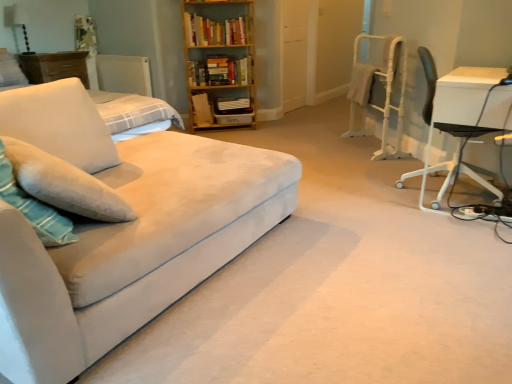
Question: Can you confirm if white fabric lampshade at upper left is smaller than white soft pillow at left, acting as the second pillow starting from the left?

Choices:
 (A) yes
 (B) no

Answer: (A)

Question: Are white fabric lampshade at upper left and white soft pillow at left, which ranks as the 1th pillow in bottom-to-top order, beside each other?

Choices:
 (A) no
 (B) yes

Answer: (A)

Question: Is white fabric lampshade at upper left not inside white soft pillow at left, which is counted as the first pillow, starting from the front?

Choices:
 (A) no
 (B) yes

Answer: (B)

Question: Does white fabric lampshade at upper left have a greater width compared to white soft pillow at left, which ranks as the 1th pillow in bottom-to-top order?

Choices:
 (A) no
 (B) yes

Answer: (A)

Question: Is white fabric lampshade at upper left to the left of white soft pillow at left, which is counted as the first pillow, starting from the front, from the viewer's perspective?

Choices:
 (A) yes
 (B) no

Answer: (A)

Question: From a real-world perspective, is wooden dresser at upper left above or below white matte radiator at upper left?

Choices:
 (A) above
 (B) below

Answer: (A)

Question: Looking at their shapes, would you say wooden dresser at upper left is wider or thinner than white matte radiator at upper left?

Choices:
 (A) wide
 (B) thin

Answer: (A)

Question: Does point (51, 52) appear closer or farther from the camera than point (124, 74)?

Choices:
 (A) closer
 (B) farther

Answer: (A)

Question: Visually, is wooden dresser at upper left positioned to the left or to the right of white matte radiator at upper left?

Choices:
 (A) left
 (B) right

Answer: (A)

Question: Is wooden bookshelf at upper center bigger or smaller than white matte radiator at upper left?

Choices:
 (A) small
 (B) big

Answer: (B)

Question: Does point (220, 33) appear closer or farther from the camera than point (120, 84)?

Choices:
 (A) closer
 (B) farther

Answer: (A)

Question: From the image's perspective, is wooden bookshelf at upper center positioned above or below white matte radiator at upper left?

Choices:
 (A) above
 (B) below

Answer: (B)

Question: In terms of height, does wooden bookshelf at upper center look taller or shorter compared to white matte radiator at upper left?

Choices:
 (A) tall
 (B) short

Answer: (A)

Question: Is point (19, 16) positioned closer to the camera than point (5, 72)?

Choices:
 (A) closer
 (B) farther

Answer: (B)

Question: From the image's perspective, relative to white soft pillow at upper left, which is the 2th pillow from right to left, is white fabric lampshade at upper left above or below?

Choices:
 (A) above
 (B) below

Answer: (A)